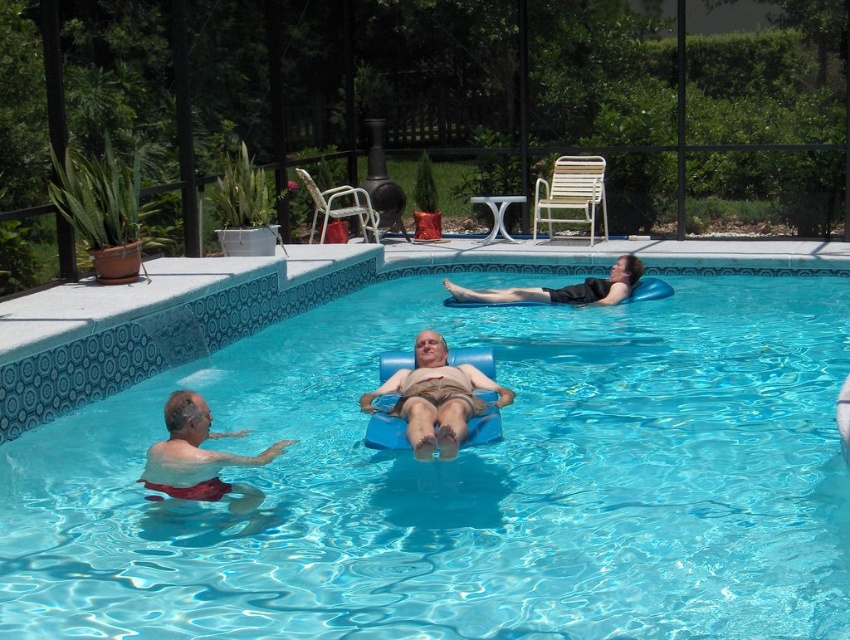
In the scene shown: You are a lifeguard observing the pool area. You notice the white matte shorts at lower left and the black fabric float at upper center. Which object is positioned higher in the image?

The white matte shorts at lower left is taller than the black fabric float at upper center, so the white matte shorts at lower left is positioned higher in the image.

You are standing at the edge of the pool and see two points in the water. The first point is at coordinates point (418, 420) and the second is at point (513, 300). Which point is closer to you?

Point (418, 420) is closer to the viewer than point (513, 300).